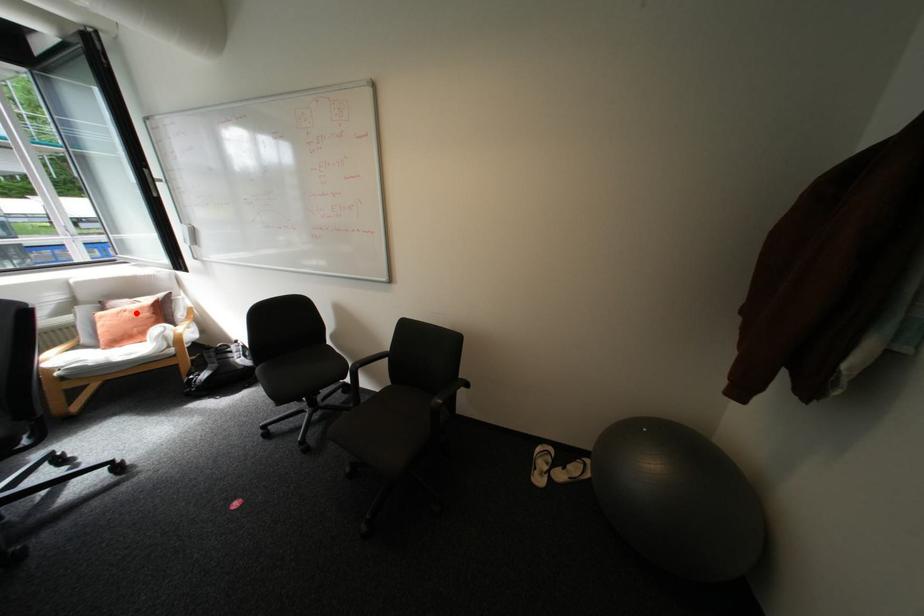
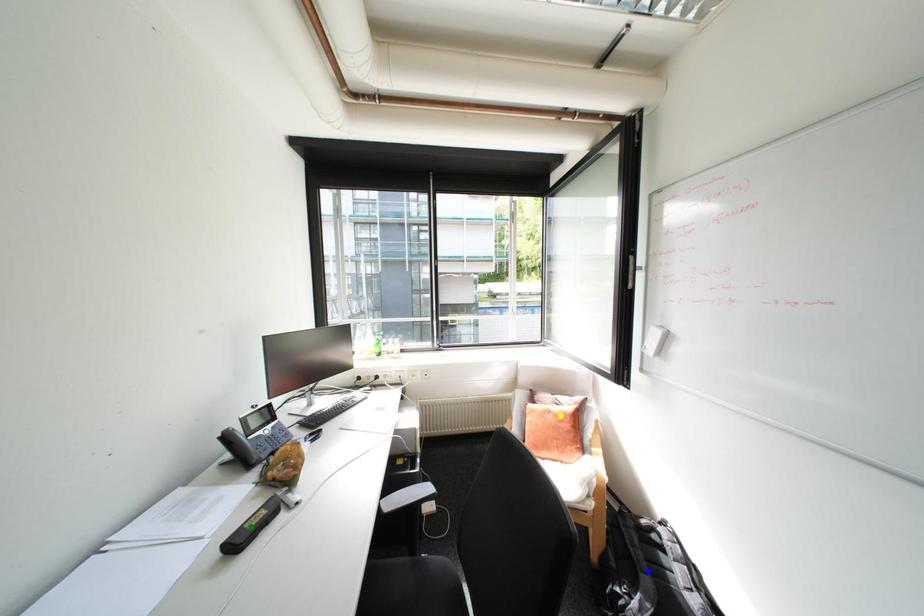
Question: I am providing you with two images of the same scene from different viewpoints. A red point is marked on the first image. You are given multiple points on the second image. Which point in image 2 is actually the same real-world point as the red point in image 1?

Choices:
 (A) blue point
 (B) yellow point
 (C) green point

Answer: (B)